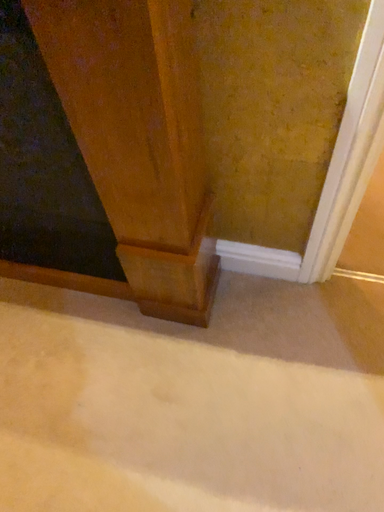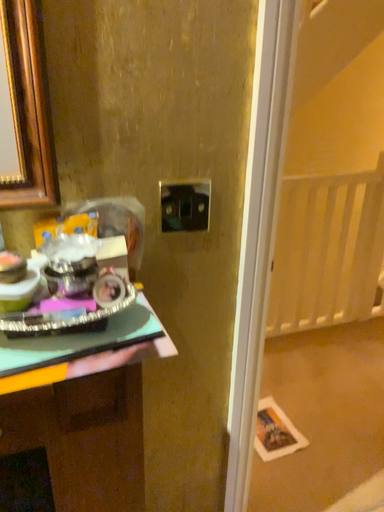
Question: Which way did the camera rotate in the video?

Choices:
 (A) rotated upward
 (B) rotated downward

Answer: (A)